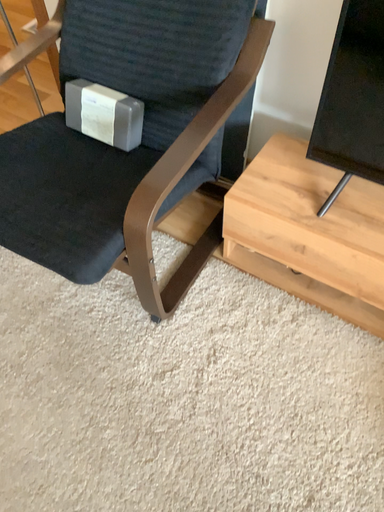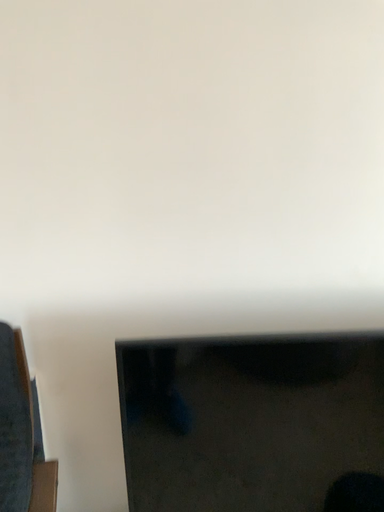
Question: Which way did the camera rotate in the video?

Choices:
 (A) rotated downward
 (B) rotated upward

Answer: (B)